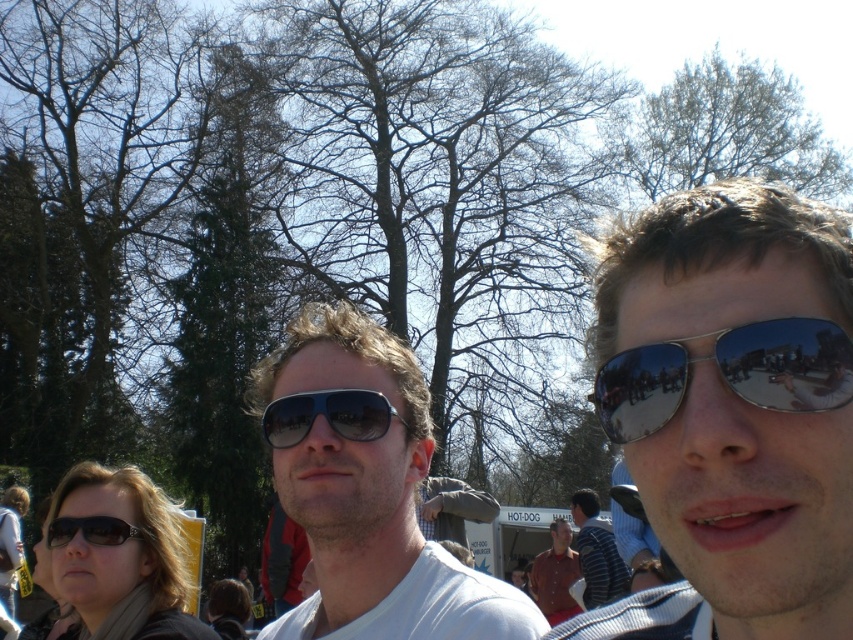
Question: Is sunglasses at center wider than matte white shirt at center?

Choices:
 (A) no
 (B) yes

Answer: (A)

Question: Based on their relative distances, which object is nearer to the matte brown shirt at center?

Choices:
 (A) matte black sunglasses at lower left
 (B) sunglasses at center
 (C) silver reflective sunglasses at right
 (D) matte black sunglasses at center

Answer: (D)

Question: Observing the image, what is the correct spatial positioning of matte white shirt at center in reference to striped cotton shirt at center?

Choices:
 (A) above
 (B) below

Answer: (A)

Question: Can you confirm if sunglasses at center is smaller than silver reflective sunglasses at right?

Choices:
 (A) no
 (B) yes

Answer: (B)

Question: Which object is positioned farthest from the matte white shirt at center?

Choices:
 (A) striped cotton shirt at center
 (B) matte brown shirt at center
 (C) matte black sunglasses at lower left
 (D) silver reflective sunglasses at right

Answer: (B)

Question: Which of these objects is positioned farthest from the matte white shirt at center?

Choices:
 (A) striped cotton shirt at center
 (B) silver reflective sunglasses at right
 (C) matte brown shirt at center
 (D) matte black sunglasses at center

Answer: (C)